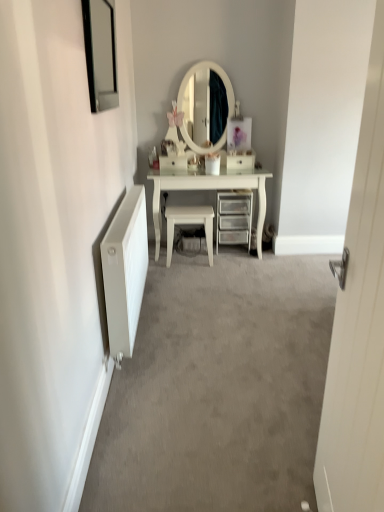
What do you see at coordinates (190, 224) in the screenshot? I see `white glossy stool at center` at bounding box center [190, 224].

Based on the photo, measure the distance between point (339, 470) and camera.

The depth of point (339, 470) is 1.22 meters.

Describe the element at coordinates (358, 325) in the screenshot. Image resolution: width=384 pixels, height=512 pixels. I see `white wooden door at right` at that location.

What do you see at coordinates (100, 53) in the screenshot?
I see `black glass picture frame at upper left` at bounding box center [100, 53].

Locate an element on the screen. Image resolution: width=384 pixels, height=512 pixels. white glossy stool at center is located at coordinates (190, 224).

Measure the distance from white radiator at left to white glossy stool at center.

The distance of white radiator at left from white glossy stool at center is 1.19 meters.

Is white radiator at left far away from white glossy stool at center?

That's right, there is a large distance between white radiator at left and white glossy stool at center.

Which object is positioned more to the right, white radiator at left or white glossy stool at center?

white radiator at left.

Is white radiator at left oriented away from white glossy stool at center?

No, white radiator at left is not facing away from white glossy stool at center.

Is white glossy drawer at center wider than white radiator at left?

No, white glossy drawer at center is not wider than white radiator at left.

From the image's perspective, is white glossy drawer at center on top of white radiator at left?

Indeed, from the image's perspective, white glossy drawer at center is shown above white radiator at left.

Is point (251, 166) more distant than point (303, 280)?

Yes, it is behind point (303, 280).

Which object is closer to the camera, white glossy stool at center or clear plastic drawers at center?

white glossy stool at center is closer to the camera.

Is white glossy stool at center aimed at clear plastic drawers at center?

No, white glossy stool at center is not turned towards clear plastic drawers at center.

Find the location of `chair in front of the clear plastic drawers at center`. chair in front of the clear plastic drawers at center is located at coordinates (190, 224).

Is clear plastic drawers at center bigger than white radiator at left?

Incorrect, clear plastic drawers at center is not larger than white radiator at left.

Does clear plastic drawers at center have a lesser width compared to white radiator at left?

Yes.

From a real-world perspective, is clear plastic drawers at center located higher than white radiator at left?

Yes, from a real-world perspective, clear plastic drawers at center is on top of white radiator at left.

Is white glossy stool at center completely or partially outside of white matte radiator at left?

Yes, white glossy stool at center is outside of white matte radiator at left.

Looking at this image, between white glossy stool at center and white matte radiator at left, which one has less height?

white glossy stool at center.

Between white glossy stool at center and white matte radiator at left, which one is positioned behind?

white glossy stool at center.

Would you say white glossy drawer at center is outside clear plastic drawers at center?

Yes.

From the image's perspective, which object appears higher, white glossy drawer at center or clear plastic drawers at center?

white glossy drawer at center appears higher in the image.

Looking at this image, measure the distance from white glossy drawer at center to clear plastic drawers at center.

white glossy drawer at center is 16.35 inches from clear plastic drawers at center.

You are a GUI agent. You are given a task and a screenshot of the screen. Output one action in this format:
    pyautogui.click(x=<x>, y=<y>)
    Task: Click on the drawer above the clear plastic drawers at center (from the image's perspective)
    The width and height of the screenshot is (384, 512).
    Given the screenshot: What is the action you would take?
    pyautogui.click(x=240, y=162)

Considering the positions of point (378, 314) and point (231, 223), is point (378, 314) closer or farther from the camera than point (231, 223)?

Point (378, 314) is closer to the camera than point (231, 223).

Is white wooden door at right wider or thinner than clear plastic drawers at center?

white wooden door at right is thinner than clear plastic drawers at center.

Can you see white wooden door at right touching clear plastic drawers at center?

No, white wooden door at right is not beside clear plastic drawers at center.

From the image's perspective, is white wooden door at right located beneath clear plastic drawers at center?

Yes, from the image's perspective, white wooden door at right is beneath clear plastic drawers at center.

Image resolution: width=384 pixels, height=512 pixels. Identify the location of plain in front of the white glossy stool at center. (218, 389).

Identify the location of drawer above the white radiator at left (from the image's perspective). (240, 162).

Considering their positions, is white glossy stool at center positioned closer to clear plastic drawers at center than white matte radiator at left?

white glossy stool at center is positioned closer to the anchor clear plastic drawers at center.

Estimate the real-world distances between objects in this image. Which object is further from white matte radiator at left, white glossy stool at center or white glossy drawer at center?

The object further to white matte radiator at left is white glossy drawer at center.

In the scene shown: Looking at the image, which one is located closer to white wooden door at right, white radiator at left or clear plastic drawers at center?

white radiator at left lies closer to white wooden door at right than the other object.

From the image, which object appears to be nearer to white matte radiator at left, clear plastic drawers at center or black glass picture frame at upper left?

Based on the image, clear plastic drawers at center appears to be nearer to white matte radiator at left.

When comparing their distances from white glossy drawer at center, does white glossy stool at center or white wooden door at right seem further?

white wooden door at right is positioned further to the anchor white glossy drawer at center.

From the image, which object appears to be nearer to white radiator at left, black glass picture frame at upper left or white glossy drawer at center?

Among the two, white glossy drawer at center is located nearer to white radiator at left.

Based on their spatial positions, is white matte radiator at left or white wooden door at right further from white glossy drawer at center?

white wooden door at right lies further to white glossy drawer at center than the other object.

When comparing their distances from white matte radiator at left, does black glass picture frame at upper left or white radiator at left seem further?

Among the two, black glass picture frame at upper left is located further to white matte radiator at left.

Where is `radiator between white radiator at left and clear plastic drawers at center along the z-axis`? The height and width of the screenshot is (512, 384). radiator between white radiator at left and clear plastic drawers at center along the z-axis is located at coordinates (125, 272).

This screenshot has height=512, width=384. I want to click on picture frame positioned between white wooden door at right and white matte radiator at left from near to far, so click(x=100, y=53).

Where is `chair between white matte radiator at left and white glossy drawer at center along the z-axis`? chair between white matte radiator at left and white glossy drawer at center along the z-axis is located at coordinates (190, 224).

The width and height of the screenshot is (384, 512). I want to click on radiator positioned between black glass picture frame at upper left and white glossy drawer at center from near to far, so [x=125, y=272].